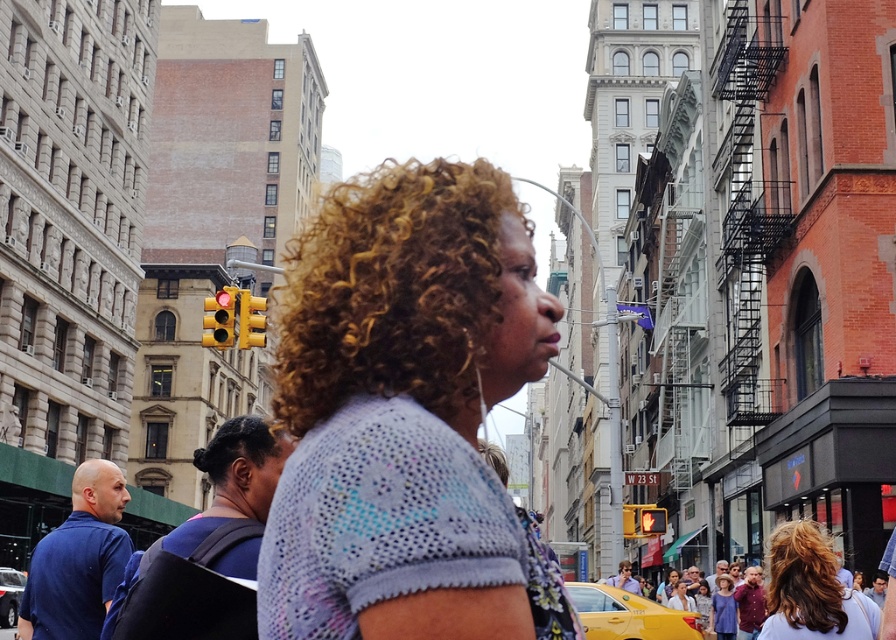
Question: Is black curly hair at center positioned before curly blonde hair at center?

Choices:
 (A) yes
 (B) no

Answer: (B)

Question: Which of these objects is positioned farthest from the light purple knit sweater at center?

Choices:
 (A) yellow matte taxi at lower center
 (B) black curly hair at center
 (C) blonde curly hair at lower right

Answer: (A)

Question: Is curly golden hair at center bigger than yellow matte taxi at lower center?

Choices:
 (A) no
 (B) yes

Answer: (A)

Question: Which point is farther from the camera taking this photo?

Choices:
 (A) (489, 486)
 (B) (770, 604)
 (C) (455, 253)
 (D) (613, 589)

Answer: (D)

Question: Among these points, which one is farthest from the camera?

Choices:
 (A) (580, 618)
 (B) (253, 435)
 (C) (382, 275)
 (D) (830, 577)

Answer: (A)

Question: Is blonde curly hair at lower right wider than yellow matte taxi at lower center?

Choices:
 (A) no
 (B) yes

Answer: (A)